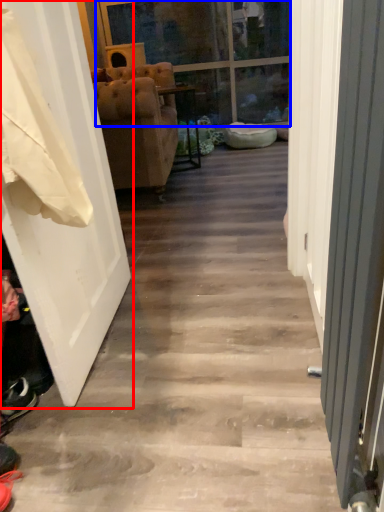
Question: Which object is further to the camera taking this photo, door (highlighted by a red box) or glass door (highlighted by a blue box)?

Choices:
 (A) door
 (B) glass door

Answer: (B)